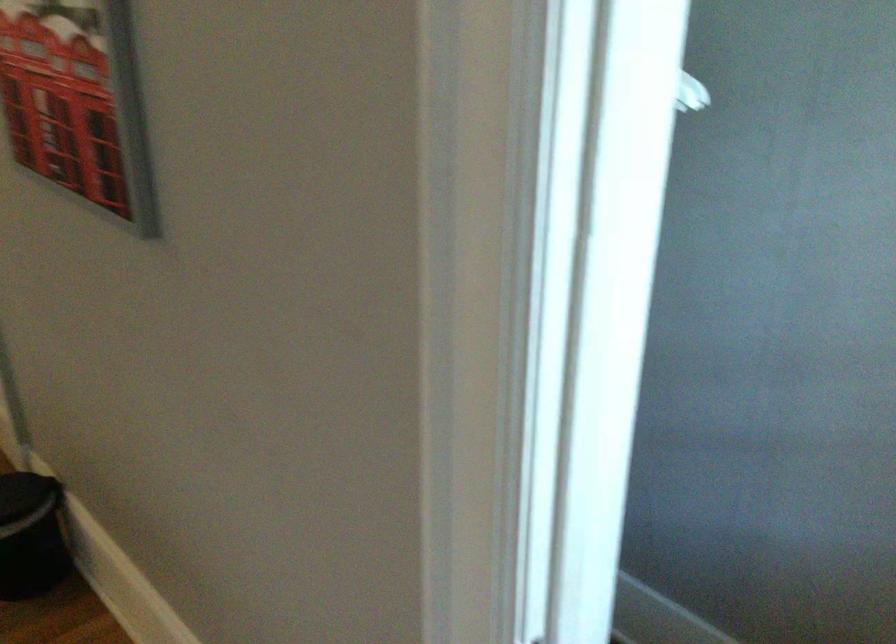
I want to click on white clothes hanger, so click(x=691, y=93).